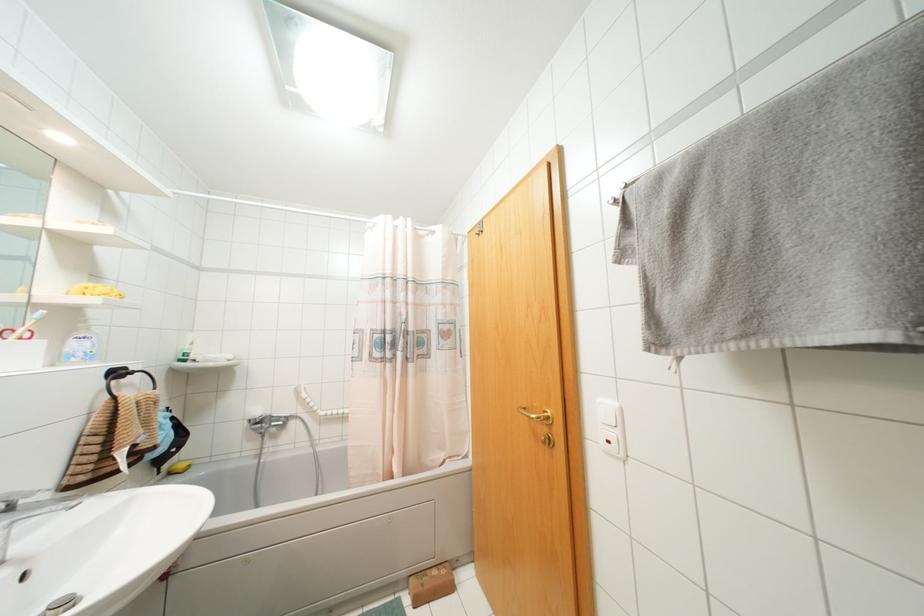
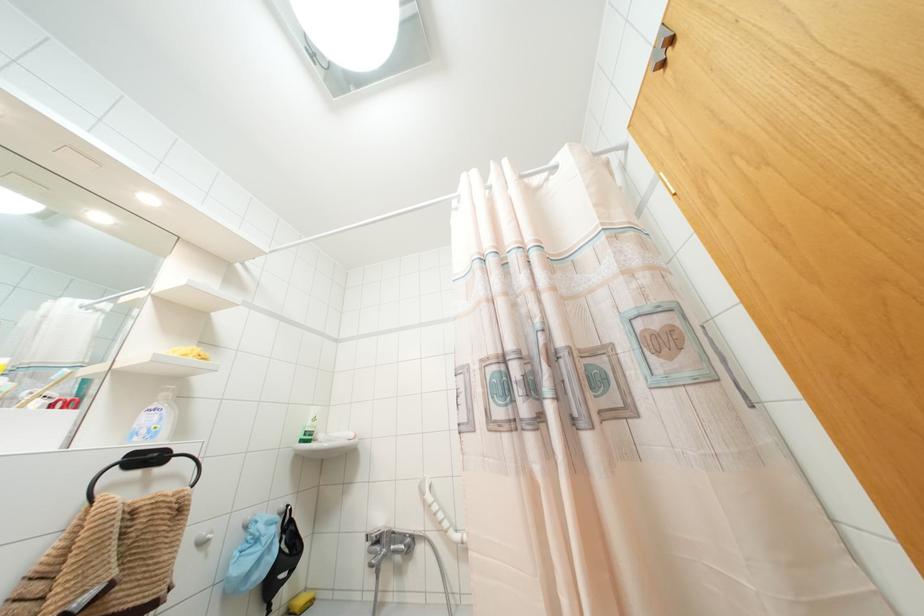
In the second image, find the point that corresponds to (116,373) in the first image.

(147, 458)